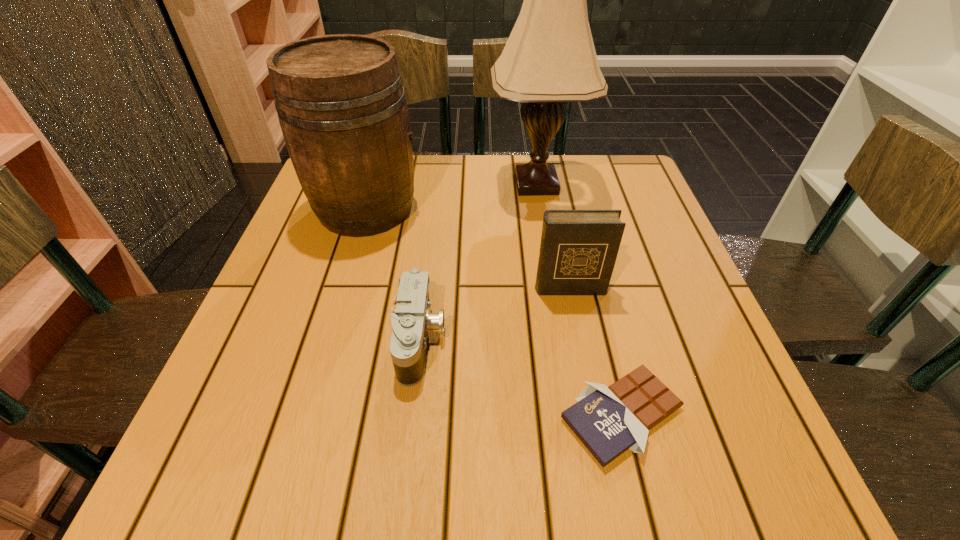
Where is `vacant point at the far edge`? The image size is (960, 540). vacant point at the far edge is located at coordinates (x=420, y=205).

The height and width of the screenshot is (540, 960). In order to click on vacant space at the near edge of the desktop in this screenshot , I will do click(x=321, y=483).

In the image, there is a desktop. Identify the location of blank space at the left edge. (286, 323).

Image resolution: width=960 pixels, height=540 pixels. In the image, there is a desktop. In order to click on vacant space at the right edge in this screenshot , I will do `click(681, 276)`.

I want to click on vacant space at the near left corner of the desktop, so [x=262, y=487].

Where is `free space between the shortest object and the third nearest object`? This screenshot has width=960, height=540. free space between the shortest object and the third nearest object is located at coordinates (595, 352).

Identify the location of unoccupied position between the lamp and the cider. (451, 196).

Find the location of a particular element. blank region between the third farthest object and the second tallest object is located at coordinates (468, 248).

I want to click on vacant space in between the shortest object and the camera, so click(521, 377).

Image resolution: width=960 pixels, height=540 pixels. In order to click on vacant space that's between the lamp and the shortest object in this screenshot , I will do `click(579, 300)`.